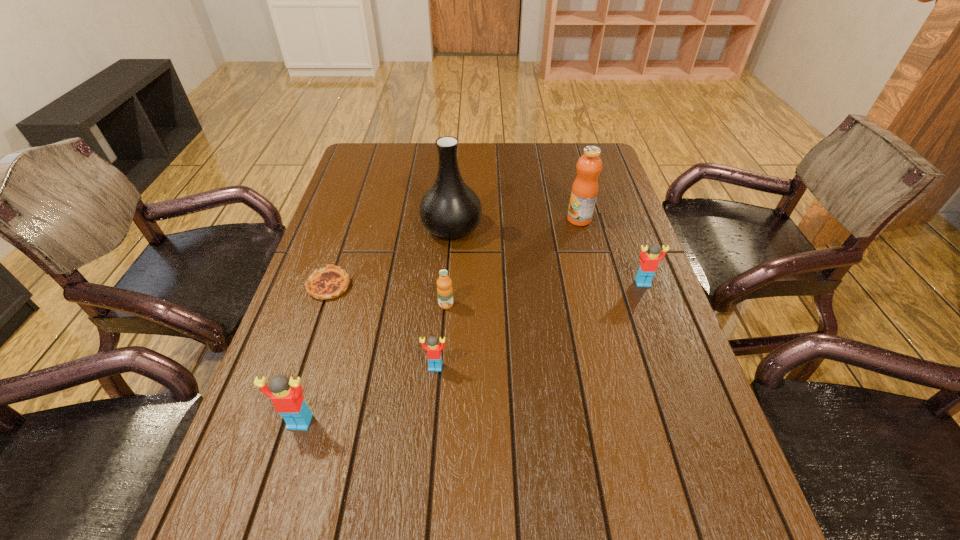
This screenshot has height=540, width=960. I want to click on the leftmost Lego, so click(286, 396).

This screenshot has width=960, height=540. I want to click on the nearest Lego, so click(286, 396).

Where is `the second Lego from left to right`? The height and width of the screenshot is (540, 960). the second Lego from left to right is located at coordinates (433, 348).

Where is `the sixth farthest object`? the sixth farthest object is located at coordinates (433, 348).

Find the location of `the rightmost object`. the rightmost object is located at coordinates (649, 262).

Find the location of a particular element. the second shortest Lego is located at coordinates (649, 262).

You are a GUI agent. You are given a task and a screenshot of the screen. Output one action in this format:
    pyautogui.click(x=<x>, y=<y>)
    Task: Click on the tallest object
    This screenshot has width=960, height=540.
    Given the screenshot: What is the action you would take?
    pyautogui.click(x=450, y=209)

Locate an element on the screen. quiche is located at coordinates (330, 282).

Where is `fruit juice`? This screenshot has height=540, width=960. fruit juice is located at coordinates (584, 191).

Locate an element on the screen. This screenshot has width=960, height=540. the sixth object from left to right is located at coordinates (584, 191).